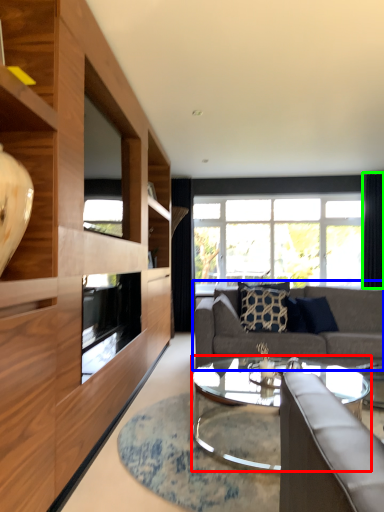
Question: Which is farther away from coffee table (highlighted by a red box)? studio couch (highlighted by a blue box) or curtain (highlighted by a green box)?

Choices:
 (A) studio couch
 (B) curtain

Answer: (B)